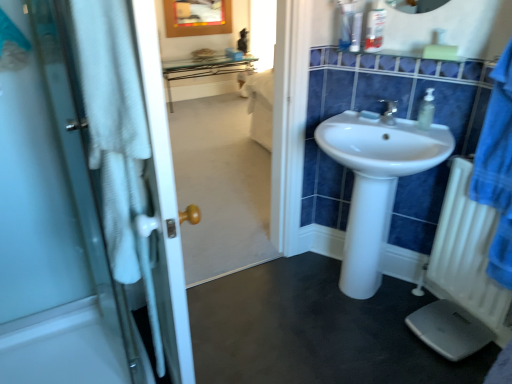
The width and height of the screenshot is (512, 384). Identify the location of vacant region under white glossy sink at center (from a real-world perspective). (362, 297).